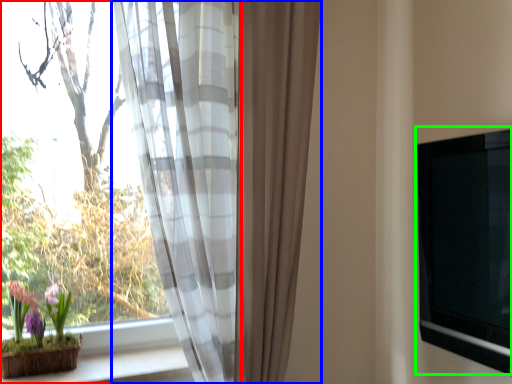
Question: Which object is positioned farthest from window (highlighted by a red box)? Select from curtain (highlighted by a blue box) and window screen (highlighted by a green box).

Choices:
 (A) curtain
 (B) window screen

Answer: (B)